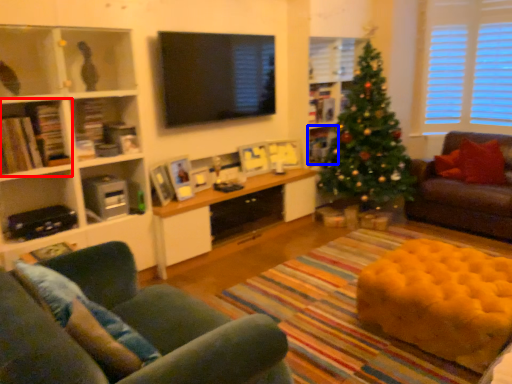
Question: Which object is further to the camera taking this photo, shelf (highlighted by a red box) or shelf (highlighted by a blue box)?

Choices:
 (A) shelf
 (B) shelf

Answer: (B)